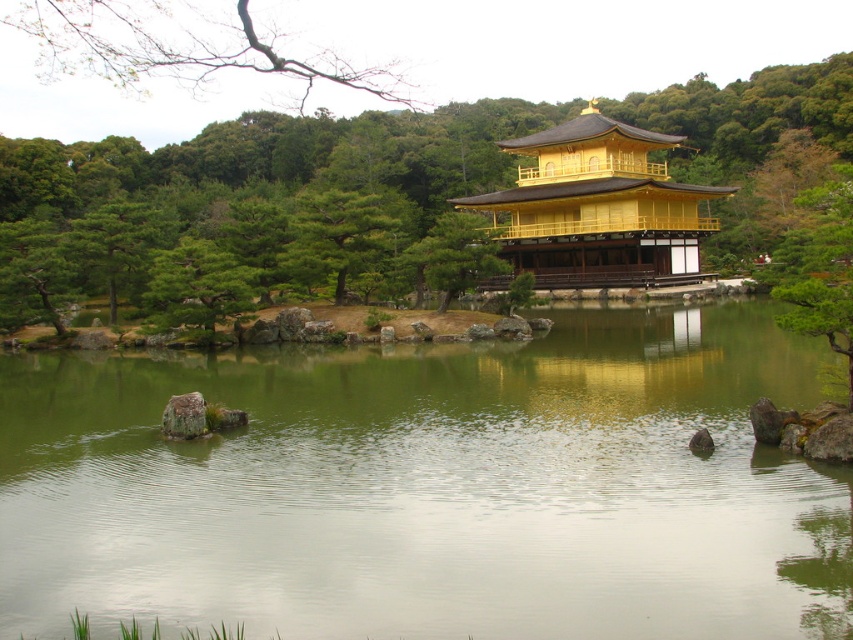
Measure the distance between green leafy tree at center and gold polished wood temple at center.

They are 42.93 meters apart.

How much distance is there between green leafy tree at center and gold polished wood temple at center?

The distance of green leafy tree at center from gold polished wood temple at center is 42.93 meters.

Find the location of a particular element. green leafy tree at center is located at coordinates (280, 161).

How much distance is there between gold polished wood temple at center and bare branches at upper left?

They are 212.04 feet apart.

Identify the location of gold polished wood temple at center. The height and width of the screenshot is (640, 853). (596, 208).

Between green reflective water at center and bare branches at upper left, which one has more height?

bare branches at upper left is taller.

Which is more to the right, green reflective water at center or bare branches at upper left?

From the viewer's perspective, green reflective water at center appears more on the right side.

Which is behind, point (646, 452) or point (323, 77)?

Point (323, 77)

In order to click on green reflective water at center in this screenshot , I will do `click(433, 486)`.